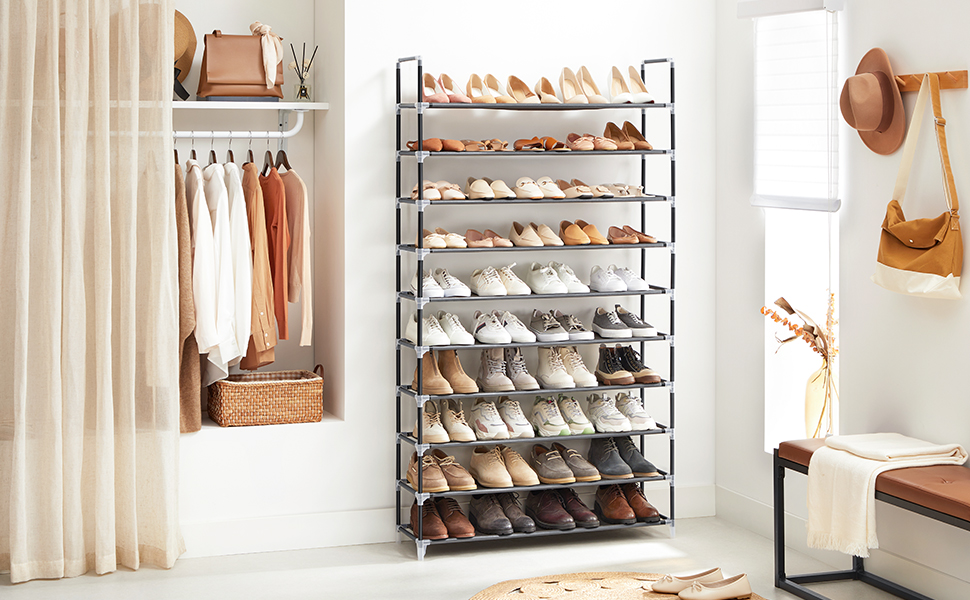
This screenshot has width=970, height=600. Find the location of `2nd shelf of shoe rack`. 2nd shelf of shoe rack is located at coordinates (437, 140), (458, 141), (473, 145), (496, 142), (530, 145), (553, 142), (579, 137), (600, 141), (624, 138), (639, 138).